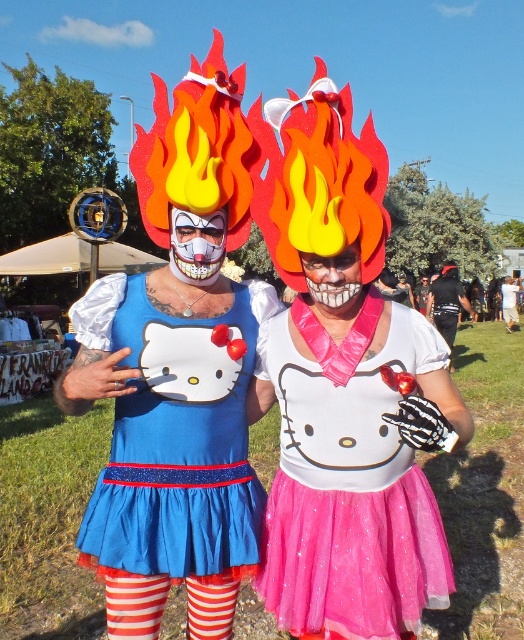
Does point (359, 556) lie in front of point (334, 266)?

That is False.

Between point (281, 618) and point (345, 316), which one is positioned in front?

Point (281, 618)

Locate an element on the screen. The width and height of the screenshot is (524, 640). pink glittery tutu at center is located at coordinates (350, 492).

Is pink glittery tutu at center smaller than blue satin hello kitty dress at center?

Yes, pink glittery tutu at center is smaller than blue satin hello kitty dress at center.

Which is behind, point (361, 406) or point (188, 337)?

The point (188, 337) is behind.

Find the location of a particular element. pink glittery tutu at center is located at coordinates (350, 492).

Where is `pink glittery tutu at center`? pink glittery tutu at center is located at coordinates (350, 492).

The width and height of the screenshot is (524, 640). Identify the location of matte clown mask at center. (196, 244).

Is point (202, 278) less distant than point (322, 316)?

That is True.

Find the location of a particular element. The width and height of the screenshot is (524, 640). matte clown mask at center is located at coordinates (196, 244).